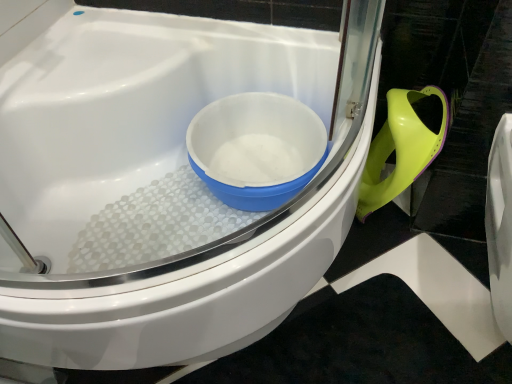
Question: From the image's perspective, is white glossy toilet at center above or below white plastic bowl at center?

Choices:
 (A) below
 (B) above

Answer: (A)

Question: In the image, is white glossy toilet at center on the left side or the right side of white plastic bowl at center?

Choices:
 (A) left
 (B) right

Answer: (A)

Question: Which is correct: white glossy toilet at center is inside white plastic bowl at center, or outside of it?

Choices:
 (A) inside
 (B) outside

Answer: (B)

Question: Based on their sizes in the image, would you say white plastic bowl at center is bigger or smaller than white glossy toilet at center?

Choices:
 (A) small
 (B) big

Answer: (A)

Question: Is point (308, 147) positioned closer to the camera than point (61, 243)?

Choices:
 (A) closer
 (B) farther

Answer: (B)

Question: Based on their positions, is white plastic bowl at center located to the left or right of white glossy toilet at center?

Choices:
 (A) right
 (B) left

Answer: (A)

Question: Considering their positions, is white plastic bowl at center located in front of or behind white glossy toilet at center?

Choices:
 (A) behind
 (B) front

Answer: (A)